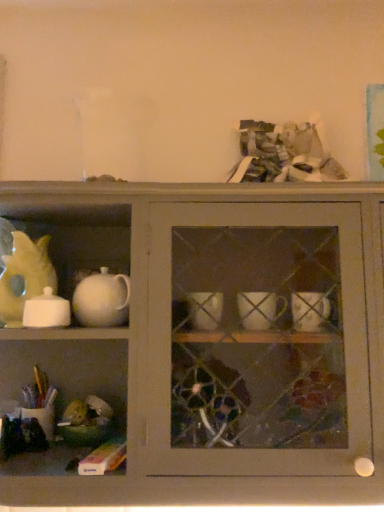
What do you see at coordinates (46, 311) in the screenshot?
I see `white glossy sugar bowl at left` at bounding box center [46, 311].

The width and height of the screenshot is (384, 512). Find the location of `white glossy teapot at upper left`. white glossy teapot at upper left is located at coordinates (204, 345).

At what (x,y) coordinates should I click in order to perform the action: click on white glossy sugar bowl at left. Please return your answer as a coordinate pair (x, y). Image resolution: width=384 pixels, height=512 pixels. Looking at the image, I should click on (46, 311).

Is yellow matte teapot at left completely or partially inside white glossy teapot at upper left?

Yes, white glossy teapot at upper left is surrounding yellow matte teapot at left.

Can you tell me how much white glossy teapot at upper left and yellow matte teapot at left differ in facing direction?

1.06 degrees separate the facing orientations of white glossy teapot at upper left and yellow matte teapot at left.

Which object is positioned more to the left, white glossy teapot at upper left or yellow matte teapot at left?

From the viewer's perspective, yellow matte teapot at left appears more on the left side.

Would you say white glossy teapot at upper left is a long distance from white glossy sugar bowl at left?

No.

From the image's perspective, which one is positioned higher, white glossy teapot at upper left or white glossy sugar bowl at left?

white glossy sugar bowl at left.

Between white glossy teapot at upper left and white glossy sugar bowl at left, which one is positioned behind?

white glossy sugar bowl at left is more distant.

Based on the photo, is white glossy teapot at upper left facing away from white glossy sugar bowl at left?

Yes, white glossy sugar bowl at left is at the back of white glossy teapot at upper left.

From the image's perspective, is yellow matte teapot at left positioned above or below white glossy sugar bowl at left?

From the image's perspective, yellow matte teapot at left appears above white glossy sugar bowl at left.

Is yellow matte teapot at left completely or partially outside of white glossy sugar bowl at left?

Absolutely, yellow matte teapot at left is external to white glossy sugar bowl at left.

From the picture: Considering the positions of objects yellow matte teapot at left and white glossy sugar bowl at left in the image provided, who is more to the left, yellow matte teapot at left or white glossy sugar bowl at left?

From the viewer's perspective, yellow matte teapot at left appears more on the left side.

Is white glossy sugar bowl at left at the back of yellow matte teapot at left?

No, yellow matte teapot at left is not facing the opposite direction of white glossy sugar bowl at left.

You are a GUI agent. You are given a task and a screenshot of the screen. Output one action in this format:
    pyautogui.click(x=<x>, y=<y>)
    Task: Click on the shelf located in front of the white glossy sugar bowl at left
    This screenshot has height=512, width=384.
    Given the screenshot: What is the action you would take?
    pyautogui.click(x=204, y=345)

Considering the relative sizes of white glossy sugar bowl at left and white glossy teapot at upper left in the image provided, is white glossy sugar bowl at left bigger than white glossy teapot at upper left?

Actually, white glossy sugar bowl at left might be smaller than white glossy teapot at upper left.

How many degrees apart are the facing directions of white glossy sugar bowl at left and white glossy teapot at upper left?

There is a 4.61-degree angle between the facing directions of white glossy sugar bowl at left and white glossy teapot at upper left.

Who is more distant, white glossy sugar bowl at left or white glossy teapot at upper left?

Positioned behind is white glossy sugar bowl at left.

Is white glossy sugar bowl at left in front of yellow matte teapot at left?

Yes, it is.

Is white glossy sugar bowl at left oriented away from yellow matte teapot at left?

No.

Can we say white glossy sugar bowl at left lies outside yellow matte teapot at left?

That's correct, white glossy sugar bowl at left is outside of yellow matte teapot at left.

Could white glossy teapot at upper left be considered to be inside yellow matte teapot at left?

No, white glossy teapot at upper left is not a part of yellow matte teapot at left.

Where is `animal located above the white glossy teapot at upper left (from the image's perspective)`? animal located above the white glossy teapot at upper left (from the image's perspective) is located at coordinates (25, 276).

Is yellow matte teapot at left behind white glossy teapot at upper left?

Yes, yellow matte teapot at left is behind white glossy teapot at upper left.

The image size is (384, 512). I want to click on animal on the left of the white glossy teapot at upper left, so click(x=25, y=276).

In order to click on tableware behind the white glossy teapot at upper left in this screenshot , I will do `click(46, 311)`.

Looking at the image, which one is located closer to white glossy teapot at upper left, white glossy sugar bowl at left or yellow matte teapot at left?

Based on the image, white glossy sugar bowl at left appears to be nearer to white glossy teapot at upper left.

Considering their positions, is white glossy sugar bowl at left positioned closer to yellow matte teapot at left than white glossy teapot at upper left?

Among the two, white glossy sugar bowl at left is located nearer to yellow matte teapot at left.

Based on their spatial positions, is yellow matte teapot at left or white glossy sugar bowl at left closer to white glossy teapot at upper left?

Based on the image, white glossy sugar bowl at left appears to be nearer to white glossy teapot at upper left.

Estimate the real-world distances between objects in this image. Which object is further from yellow matte teapot at left, white glossy teapot at upper left or white glossy sugar bowl at left?

Among the two, white glossy teapot at upper left is located further to yellow matte teapot at left.

Based on their spatial positions, is yellow matte teapot at left or white glossy teapot at upper left further from white glossy sugar bowl at left?

The object further to white glossy sugar bowl at left is white glossy teapot at upper left.

Which object lies further to the anchor point white glossy sugar bowl at left, white glossy teapot at upper left or yellow matte teapot at left?

white glossy teapot at upper left is further to white glossy sugar bowl at left.

At what (x,y) coordinates should I click in order to perform the action: click on tableware between yellow matte teapot at left and white glossy teapot at upper left in the horizontal direction. Please return your answer as a coordinate pair (x, y). The image size is (384, 512). Looking at the image, I should click on (46, 311).